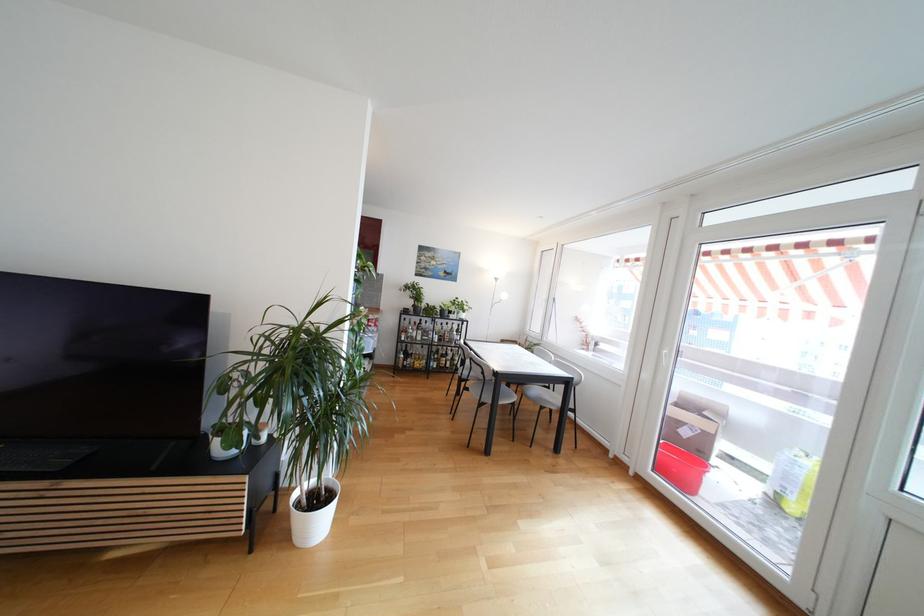
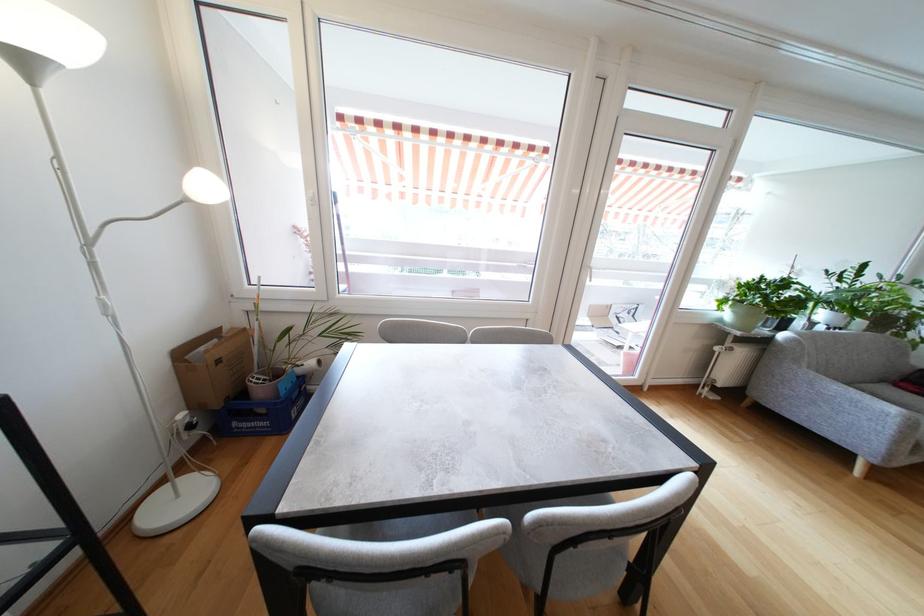
Question: I am providing you with two images of the same scene from different viewpoints. After the viewpoint changes to image2, which objects are now occluded?

Choices:
 (A) grey chair sitting surface
 (B) blue plastic crate
 (C) white plant pot
 (D) pair of dark shoes

Answer: (A)